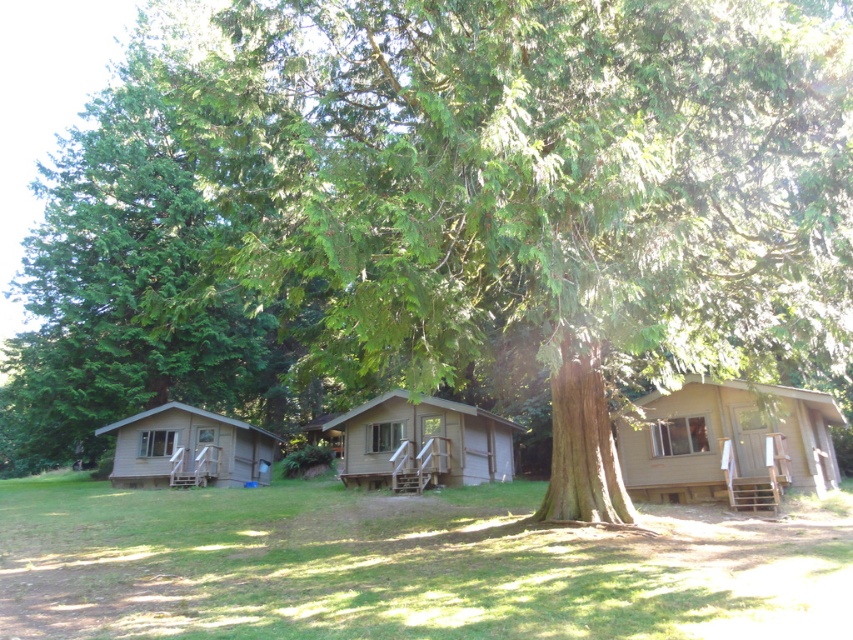
Is green textured tree at left smaller than brown wood cabin at right?

Incorrect, green textured tree at left is not smaller in size than brown wood cabin at right.

Is point (142, 195) farther from viewer compared to point (645, 444)?

Yes, it is behind point (645, 444).

Where is `green textured tree at left`? The image size is (853, 640). green textured tree at left is located at coordinates (128, 282).

The width and height of the screenshot is (853, 640). I want to click on green textured tree at left, so click(x=128, y=282).

Does brown wood cabin at center appear on the left side of brown wood cabin at left?

Incorrect, brown wood cabin at center is not on the left side of brown wood cabin at left.

Is point (352, 410) closer to camera compared to point (177, 420)?

Yes.

Image resolution: width=853 pixels, height=640 pixels. I want to click on brown wood cabin at center, so click(x=422, y=442).

Which is above, green grass at lower center or brown wood cabin at right?

brown wood cabin at right is higher up.

The image size is (853, 640). What are the coordinates of `green grass at lower center` in the screenshot? It's located at (399, 566).

This screenshot has width=853, height=640. I want to click on green grass at lower center, so click(x=399, y=566).